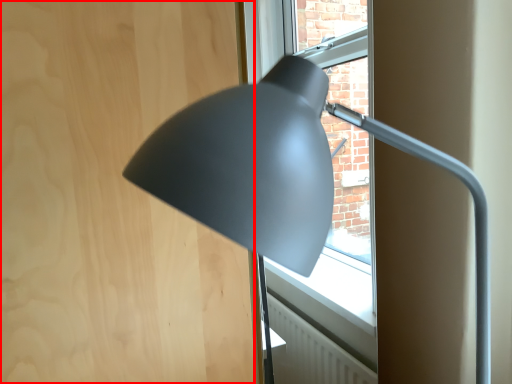
Question: From the image's perspective, considering the relative positions of plywood (annotated by the red box) and lamp in the image provided, where is plywood (annotated by the red box) located with respect to the staircase?

Choices:
 (A) below
 (B) above

Answer: (A)